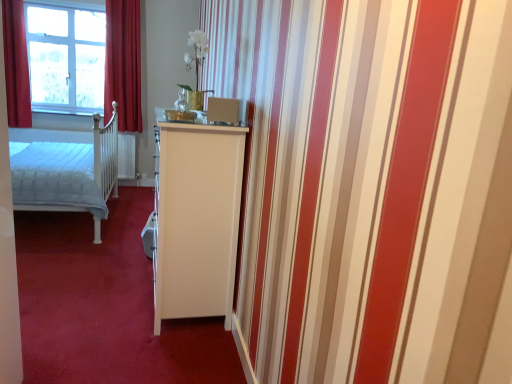
Question: Is white glossy cabinet at center smaller than velvet red curtain at upper left, the second curtain positioned from the left?

Choices:
 (A) yes
 (B) no

Answer: (B)

Question: Does white glossy cabinet at center come behind velvet red curtain at upper left, which ranks as the first curtain in right-to-left order?

Choices:
 (A) no
 (B) yes

Answer: (A)

Question: Does white glossy cabinet at center have a greater width compared to velvet red curtain at upper left, the second curtain positioned from the left?

Choices:
 (A) no
 (B) yes

Answer: (B)

Question: Is white glossy cabinet at center shorter than velvet red curtain at upper left, which ranks as the first curtain in right-to-left order?

Choices:
 (A) no
 (B) yes

Answer: (B)

Question: Considering the relative positions of white glossy cabinet at center and velvet red curtain at upper left, the second curtain positioned from the left, in the image provided, is white glossy cabinet at center to the left of velvet red curtain at upper left, the second curtain positioned from the left, from the viewer's perspective?

Choices:
 (A) yes
 (B) no

Answer: (B)

Question: Is the surface of white glossy cabinet at center in direct contact with velvet red curtain at upper left, which ranks as the first curtain in right-to-left order?

Choices:
 (A) yes
 (B) no

Answer: (B)

Question: Considering the relative sizes of white quilted fabric bed at left and clear glass window at upper left in the image provided, is white quilted fabric bed at left smaller than clear glass window at upper left?

Choices:
 (A) no
 (B) yes

Answer: (A)

Question: Can you confirm if white quilted fabric bed at left is wider than clear glass window at upper left?

Choices:
 (A) yes
 (B) no

Answer: (A)

Question: From the image's perspective, is white quilted fabric bed at left over clear glass window at upper left?

Choices:
 (A) yes
 (B) no

Answer: (B)

Question: Is white quilted fabric bed at left not within clear glass window at upper left?

Choices:
 (A) no
 (B) yes

Answer: (B)

Question: Would you say white quilted fabric bed at left contains clear glass window at upper left?

Choices:
 (A) yes
 (B) no

Answer: (B)

Question: From a real-world perspective, does white quilted fabric bed at left sit lower than clear glass window at upper left?

Choices:
 (A) yes
 (B) no

Answer: (A)

Question: Is white glossy cabinet at center positioned beyond the bounds of clear glass window at upper left?

Choices:
 (A) yes
 (B) no

Answer: (A)